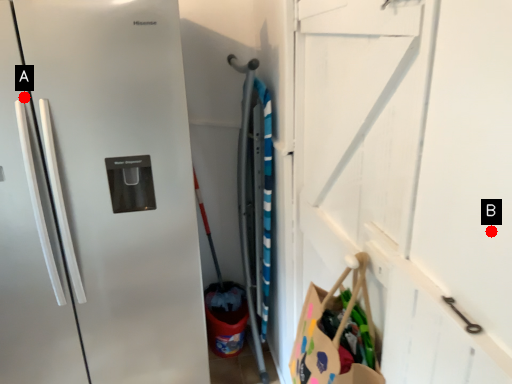
Question: Two points are circled on the image, labeled by A and B beside each circle. Which point appears farthest from the camera in this image?

Choices:
 (A) A is further
 (B) B is further

Answer: (A)